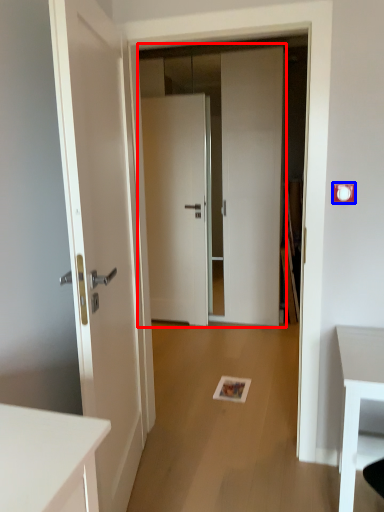
Question: Which object is further to the camera taking this photo, door (highlighted by a red box) or electric outlet (highlighted by a blue box)?

Choices:
 (A) door
 (B) electric outlet

Answer: (A)